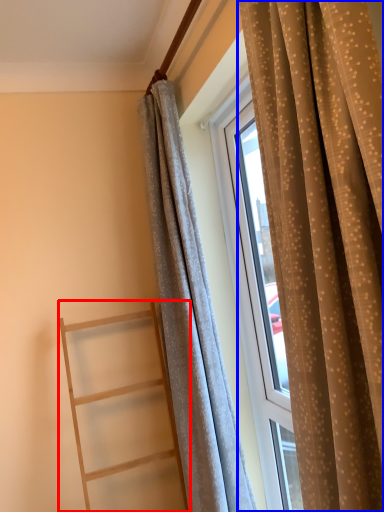
Question: Which object is closer to the camera taking this photo, ladder (highlighted by a red box) or curtain (highlighted by a blue box)?

Choices:
 (A) ladder
 (B) curtain

Answer: (B)